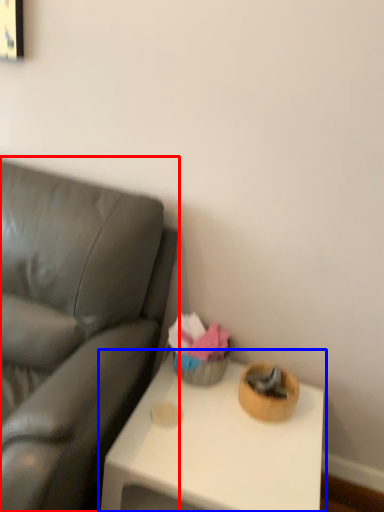
Question: Which of the following is the closest to the observer, studio couch (highlighted by a red box) or table (highlighted by a blue box)?

Choices:
 (A) studio couch
 (B) table

Answer: (A)